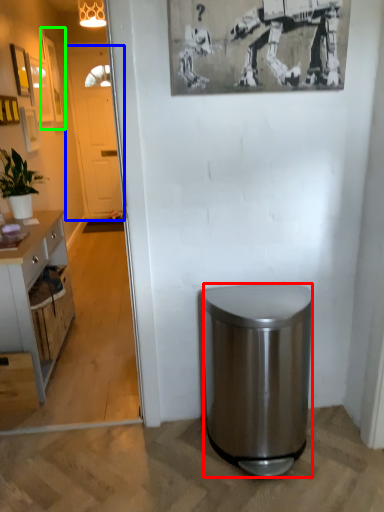
Question: Which is farther away from trash bin/can (highlighted by a red box)? glass door (highlighted by a blue box) or picture frame (highlighted by a green box)?

Choices:
 (A) glass door
 (B) picture frame

Answer: (A)